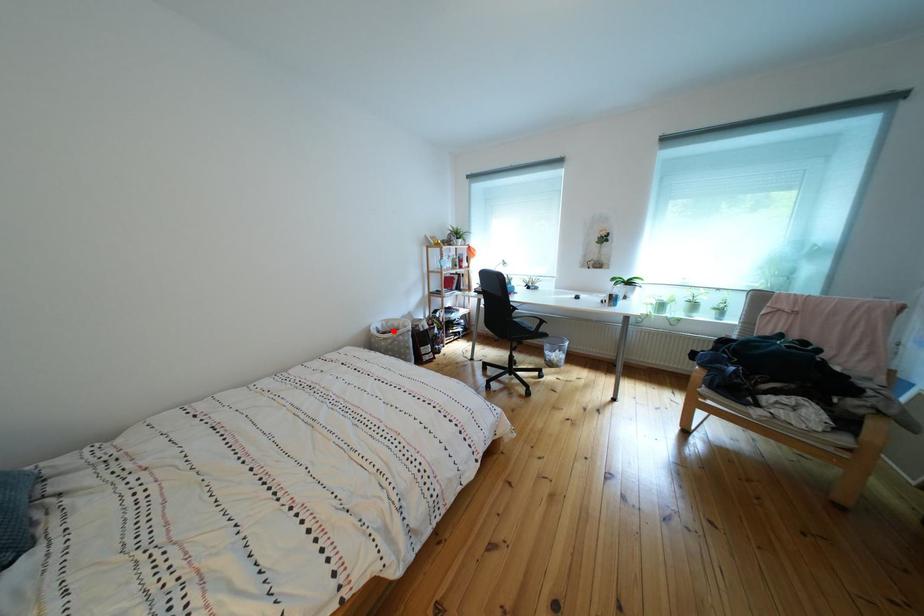
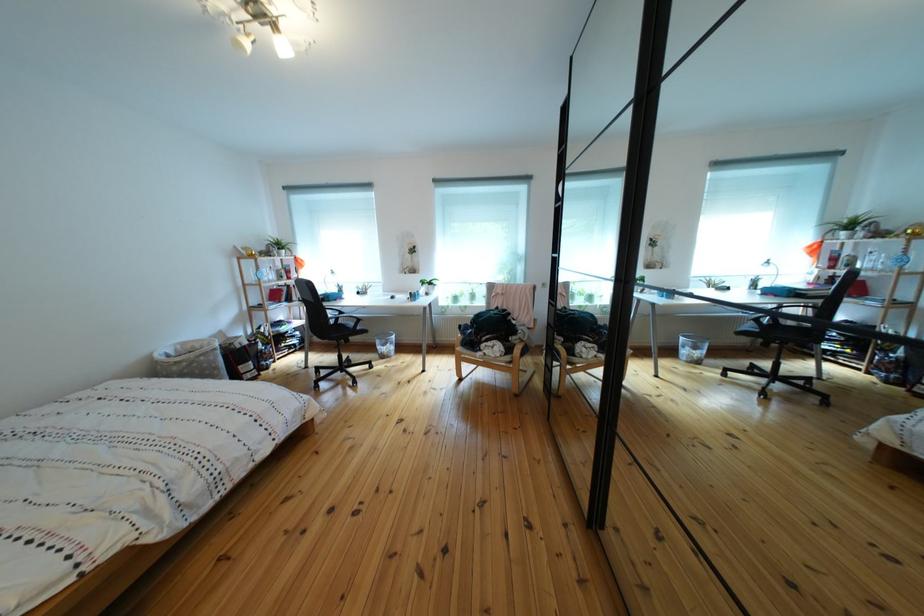
The point at the highlighted location is marked in the first image. Where is the corresponding point in the second image?

(187, 355)